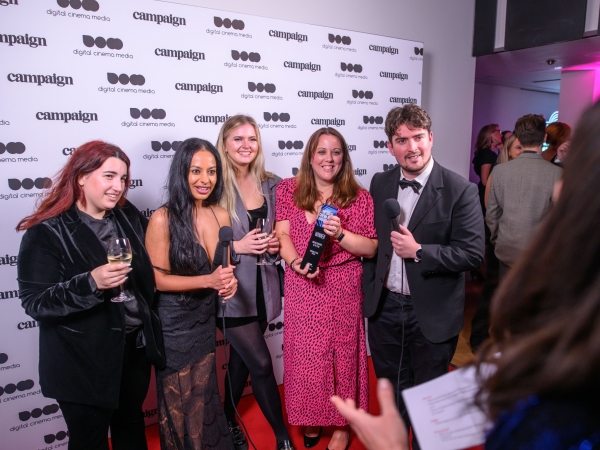
This screenshot has width=600, height=450. In order to click on glass of champagne in this screenshot , I will do `click(121, 251)`.